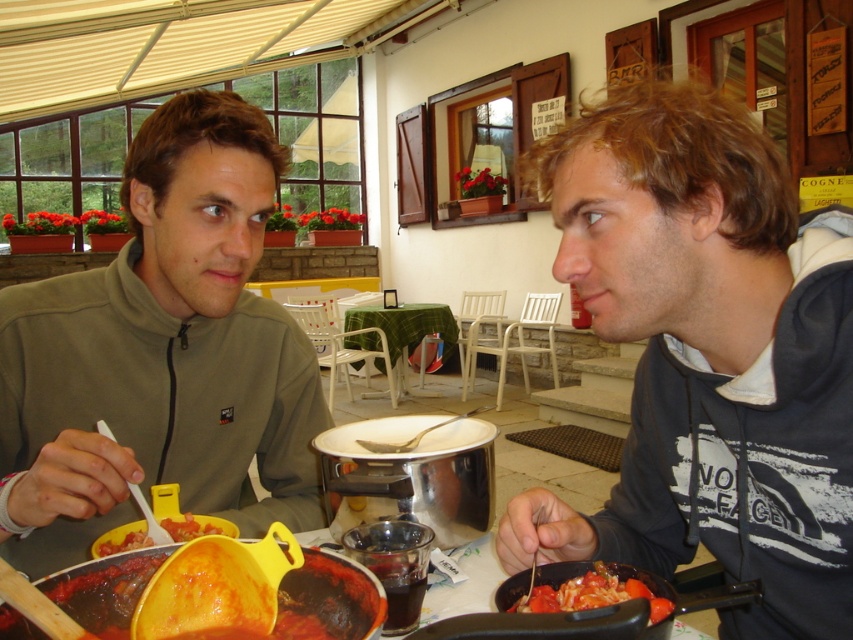
You are a photographer taking a picture of the table. You notice two points on the table at coordinates point (534, 516) and point (392, 346). Which point will appear larger in the photo?

Point (534, 516) is closer to the camera than point (392, 346), so it will appear larger in the photo.